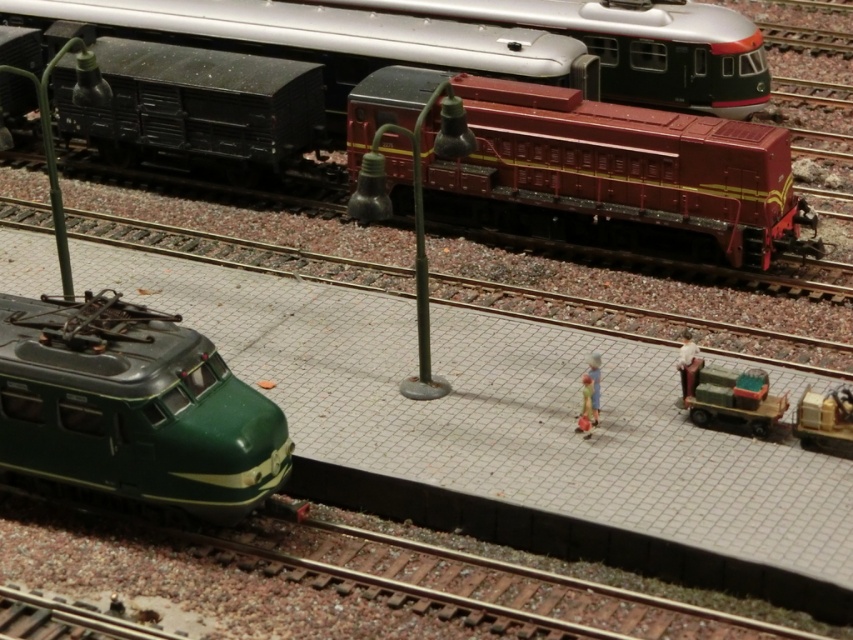
Question: Which of the following is the closest to the observer?

Choices:
 (A) (727, 113)
 (B) (537, 157)
 (C) (599, 192)

Answer: (C)

Question: Estimate the real-world distances between objects in this image. Which object is farther from the maroon glossy locomotive at center?

Choices:
 (A) metallic silver train at upper center
 (B) maroon metallic locomotive at upper center
 (C) green glossy train at lower left

Answer: (B)

Question: Does maroon glossy locomotive at center come in front of metallic silver train at upper center?

Choices:
 (A) yes
 (B) no

Answer: (A)

Question: Which point is closer to the camera?

Choices:
 (A) maroon metallic locomotive at upper center
 (B) metallic silver train at upper center
 (C) maroon glossy locomotive at center

Answer: (C)

Question: Is maroon glossy locomotive at center above green glossy train at lower left?

Choices:
 (A) no
 (B) yes

Answer: (B)

Question: Is maroon metallic locomotive at upper center closer to the viewer compared to green glossy train at lower left?

Choices:
 (A) no
 (B) yes

Answer: (A)